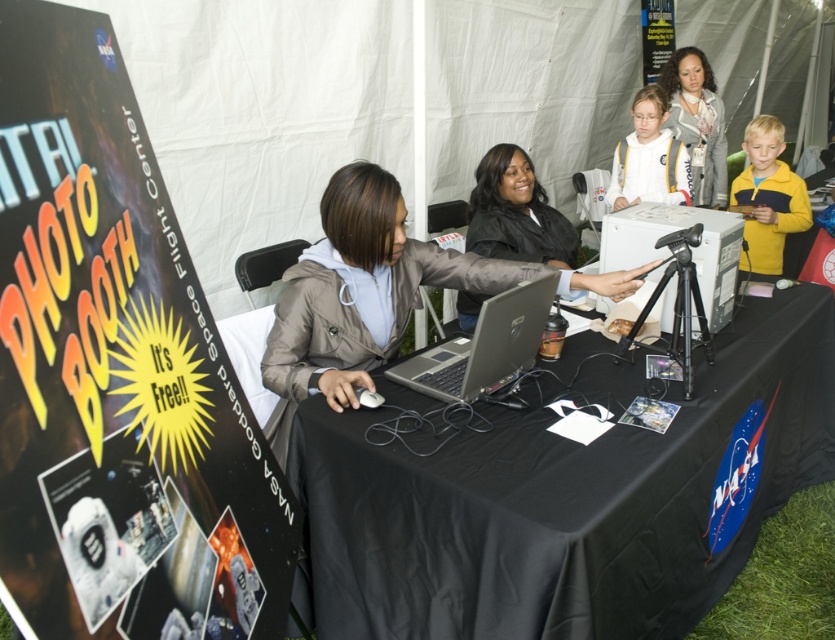
You are organizing a photo shoot and need to ensure that all participants can comfortably wear their jackets while sitting at the table. Given the space available, can the participant wearing the yellow fleece jacket at right and the matte gray hoodie at upper center sit side by side without overlapping?

The yellow fleece jacket at right is wider than the matte gray hoodie at upper center. Since the table is covered with a NASA logo cloth and has items like a laptop and camera, there might not be enough space for both jackets to sit side by side comfortably without overlapping.

Looking at this image, you are at the NASA photo booth event and need to locate the table with the NASA logo. According to the coordinates provided, where exactly is the black fabric table at center positioned?

The black fabric table at center is positioned at coordinates point (559, 496).